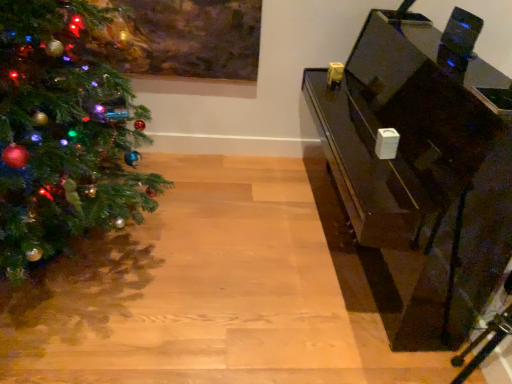
Question: Should I look upward or downward to see shiny green christmas tree at left?

Choices:
 (A) up
 (B) down

Answer: (A)

Question: Is glossy black piano at right turned away from shiny green christmas tree at left?

Choices:
 (A) no
 (B) yes

Answer: (A)

Question: Does glossy black piano at right appear on the left side of shiny green christmas tree at left?

Choices:
 (A) yes
 (B) no

Answer: (B)

Question: Is glossy black piano at right behind shiny green christmas tree at left?

Choices:
 (A) no
 (B) yes

Answer: (B)

Question: Considering the relative sizes of glossy black piano at right and shiny green christmas tree at left in the image provided, is glossy black piano at right smaller than shiny green christmas tree at left?

Choices:
 (A) yes
 (B) no

Answer: (A)

Question: Is glossy black piano at right far away from shiny green christmas tree at left?

Choices:
 (A) yes
 (B) no

Answer: (A)

Question: Considering the relative sizes of glossy black piano at right and shiny green christmas tree at left in the image provided, is glossy black piano at right thinner than shiny green christmas tree at left?

Choices:
 (A) no
 (B) yes

Answer: (B)

Question: Is shiny green christmas tree at left further to camera compared to glossy black piano at right?

Choices:
 (A) no
 (B) yes

Answer: (A)

Question: Would you say shiny green christmas tree at left contains glossy black piano at right?

Choices:
 (A) yes
 (B) no

Answer: (B)

Question: Would you say shiny green christmas tree at left is a long distance from glossy black piano at right?

Choices:
 (A) yes
 (B) no

Answer: (A)

Question: Is shiny green christmas tree at left outside glossy black piano at right?

Choices:
 (A) no
 (B) yes

Answer: (B)

Question: Considering the relative positions of shiny green christmas tree at left and glossy black piano at right in the image provided, is shiny green christmas tree at left to the right of glossy black piano at right from the viewer's perspective?

Choices:
 (A) yes
 (B) no

Answer: (B)

Question: Can you confirm if shiny green christmas tree at left is taller than glossy black piano at right?

Choices:
 (A) yes
 (B) no

Answer: (A)

Question: Relative to shiny green christmas tree at left, is glossy black piano at right in front or behind?

Choices:
 (A) front
 (B) behind

Answer: (B)